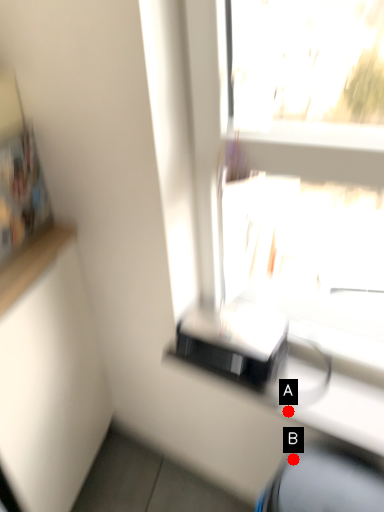
Question: Two points are circled on the image, labeled by A and B beside each circle. Which of the following is the farthest from the observer?

Choices:
 (A) A is further
 (B) B is further

Answer: (A)